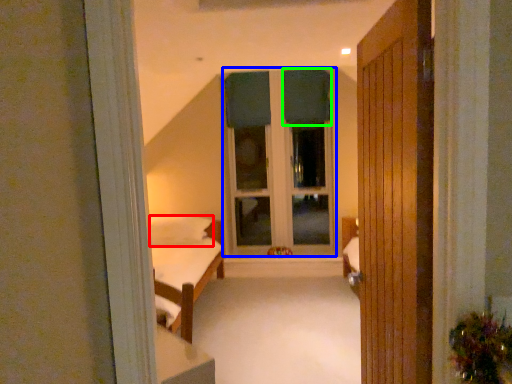
Question: Which object is the closest to the pillow (highlighted by a red box)? Choose among these: bay window (highlighted by a blue box) or curtain (highlighted by a green box).

Choices:
 (A) bay window
 (B) curtain

Answer: (A)